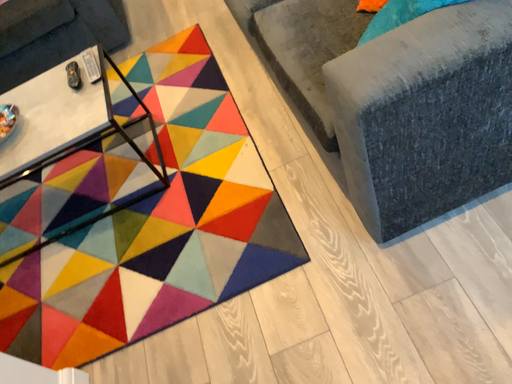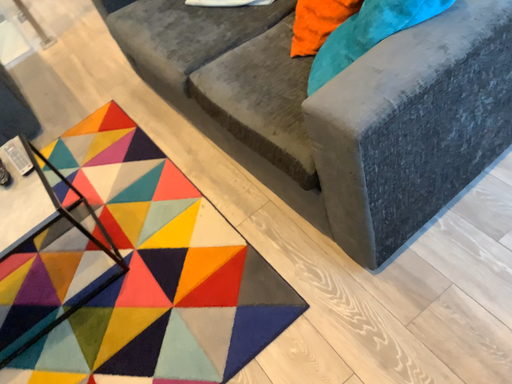
Question: Which way did the camera rotate in the video?

Choices:
 (A) rotated left
 (B) rotated right

Answer: (B)